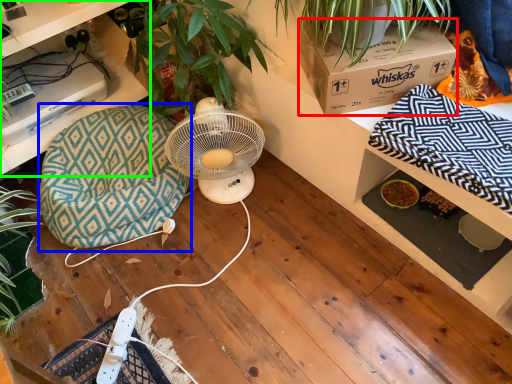
Question: Which is nearer to the box (highlighted by a red box)? bean bag chair (highlighted by a blue box) or desk (highlighted by a green box).

Choices:
 (A) bean bag chair
 (B) desk

Answer: (A)